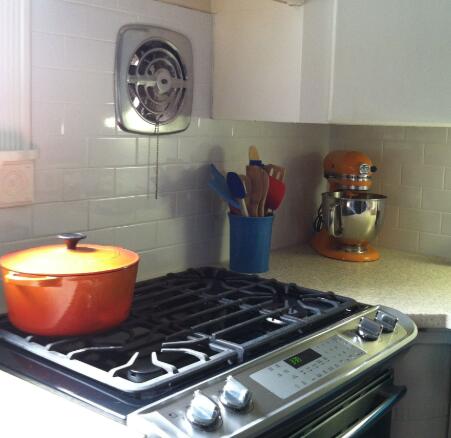
Image resolution: width=451 pixels, height=438 pixels. In order to click on gas stove in this screenshot , I will do 194,314.